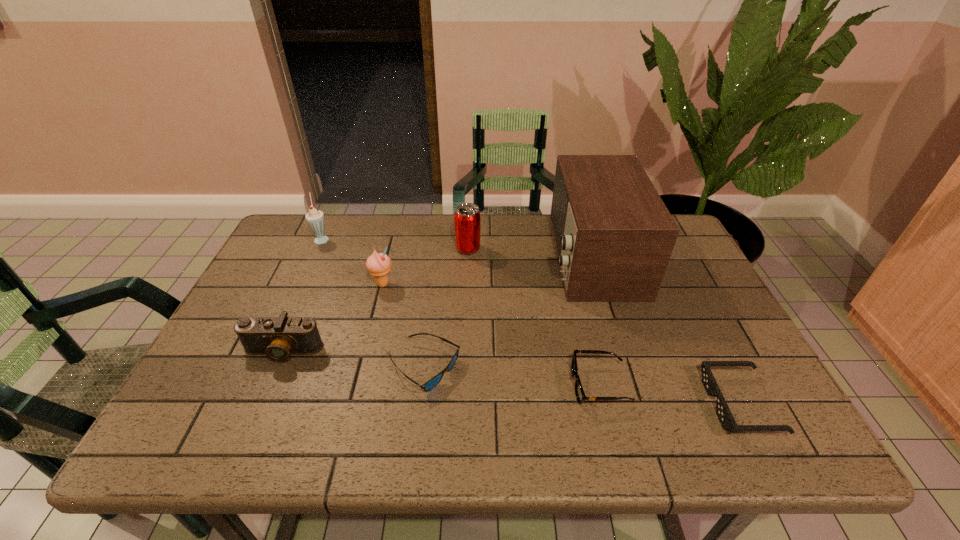
Identify the location of free space located on the front-facing side of the tallest object. Image resolution: width=960 pixels, height=540 pixels. (440, 256).

Find the location of `vacant space positioned on the front-facing side of the tallest object`. vacant space positioned on the front-facing side of the tallest object is located at coordinates (420, 256).

I want to click on vacant space located 0.160m on the back of the soda can, so click(469, 214).

The image size is (960, 540). I want to click on free location located 0.320m on the straw side of the milkshake, so click(431, 238).

Find the location of a particular element. Image resolution: width=960 pixels, height=540 pixels. vacant space located on the left of the fourth tallest object is located at coordinates (306, 284).

What are the coordinates of `blank area located 0.180m on the lens of the fifth tallest object` in the screenshot? It's located at (245, 438).

Locate an element on the screen. This screenshot has height=540, width=960. free space located 0.390m on the front-facing side of the second sunglasses from right to left is located at coordinates (397, 385).

Find the location of a particular element. This screenshot has width=960, height=540. vacant space located 0.250m on the front-facing side of the second sunglasses from right to left is located at coordinates (460, 385).

Locate an element on the screen. This screenshot has height=540, width=960. vacant position located on the front-facing side of the second sunglasses from right to left is located at coordinates (540, 385).

What are the coordinates of `free space located 0.120m at the front of the leftmost sunglasses showing the lenses` in the screenshot? It's located at (512, 368).